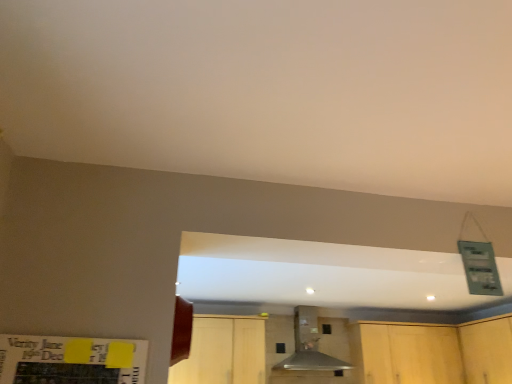
Question: From the image's perspective, is light wood cabinet at lower center, which ranks as the 3th cabinetry in right-to-left order, below wooden cabinet at lower right, which ranks as the 3th cabinetry in left-to-right order?

Choices:
 (A) no
 (B) yes

Answer: (A)

Question: Can you see light wood cabinet at lower center, which ranks as the 3th cabinetry in right-to-left order, touching wooden cabinet at lower right, which ranks as the 3th cabinetry in left-to-right order?

Choices:
 (A) no
 (B) yes

Answer: (A)

Question: Could wooden cabinet at lower right, which ranks as the 3th cabinetry in left-to-right order, be considered to be inside light wood cabinet at lower center, which ranks as the 3th cabinetry in right-to-left order?

Choices:
 (A) yes
 (B) no

Answer: (B)

Question: Would you say light wood cabinet at lower center, which ranks as the 3th cabinetry in right-to-left order, is outside wooden cabinet at lower right, which ranks as the 3th cabinetry in left-to-right order?

Choices:
 (A) no
 (B) yes

Answer: (B)

Question: Does light wood cabinet at lower center, which ranks as the 3th cabinetry in right-to-left order, have a lesser height compared to wooden cabinet at lower right, the 1th cabinetry in the right-to-left sequence?

Choices:
 (A) yes
 (B) no

Answer: (B)

Question: From the image's perspective, is metallic gray vent at center above or below wooden cabinet at lower right, which ranks as the 3th cabinetry in left-to-right order?

Choices:
 (A) below
 (B) above

Answer: (B)

Question: Which is correct: metallic gray vent at center is inside wooden cabinet at lower right, the 1th cabinetry in the right-to-left sequence, or outside of it?

Choices:
 (A) inside
 (B) outside

Answer: (B)

Question: Visually, is metallic gray vent at center positioned to the left or to the right of wooden cabinet at lower right, which ranks as the 3th cabinetry in left-to-right order?

Choices:
 (A) left
 (B) right

Answer: (A)

Question: Considering the positions of metallic gray vent at center and wooden cabinet at lower right, the 1th cabinetry in the right-to-left sequence, in the image, is metallic gray vent at center taller or shorter than wooden cabinet at lower right, the 1th cabinetry in the right-to-left sequence,?

Choices:
 (A) short
 (B) tall

Answer: (B)

Question: From a real-world perspective, is light wood cabinetry at lower right, arranged as the 2th cabinetry when viewed from the left, positioned above or below wooden cabinet at lower right, which ranks as the 3th cabinetry in left-to-right order?

Choices:
 (A) above
 (B) below

Answer: (A)

Question: Is point (492, 359) positioned closer to the camera than point (482, 329)?

Choices:
 (A) closer
 (B) farther

Answer: (A)

Question: Considering the positions of light wood cabinetry at lower right, the second cabinetry viewed from the right, and wooden cabinet at lower right, the 1th cabinetry in the right-to-left sequence, in the image, is light wood cabinetry at lower right, the second cabinetry viewed from the right, bigger or smaller than wooden cabinet at lower right, the 1th cabinetry in the right-to-left sequence,?

Choices:
 (A) small
 (B) big

Answer: (B)

Question: Is light wood cabinetry at lower right, the second cabinetry viewed from the right, wider or thinner than wooden cabinet at lower right, which ranks as the 3th cabinetry in left-to-right order?

Choices:
 (A) wide
 (B) thin

Answer: (A)

Question: Considering the positions of light wood cabinetry at lower right, the second cabinetry viewed from the right, and light wood cabinet at lower center, which is the 1th cabinetry in left-to-right order, in the image, is light wood cabinetry at lower right, the second cabinetry viewed from the right, bigger or smaller than light wood cabinet at lower center, which is the 1th cabinetry in left-to-right order,?

Choices:
 (A) big
 (B) small

Answer: (A)

Question: Considering the relative positions of light wood cabinetry at lower right, arranged as the 2th cabinetry when viewed from the left, and light wood cabinet at lower center, which ranks as the 3th cabinetry in right-to-left order, in the image provided, is light wood cabinetry at lower right, arranged as the 2th cabinetry when viewed from the left, to the left or to the right of light wood cabinet at lower center, which ranks as the 3th cabinetry in right-to-left order,?

Choices:
 (A) left
 (B) right

Answer: (B)